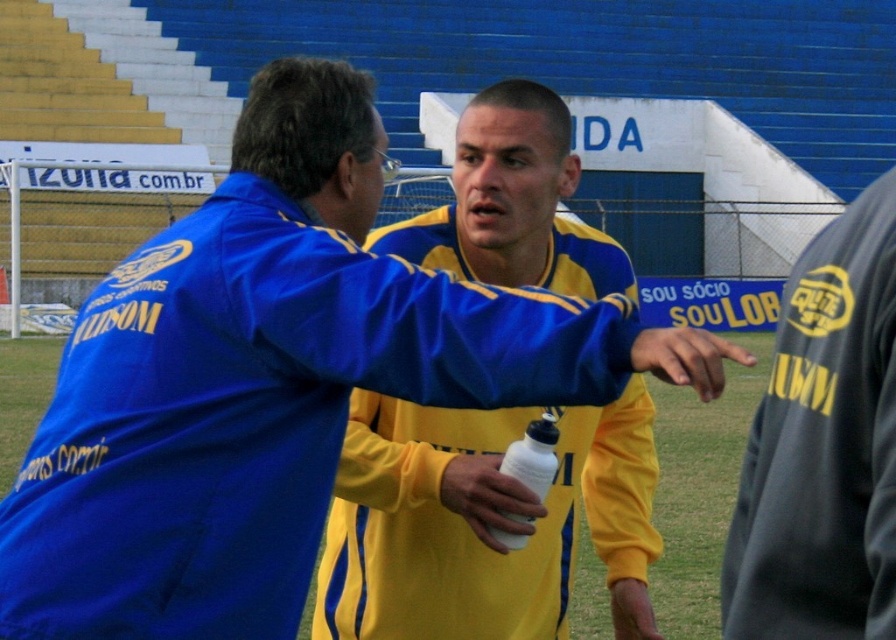
You are a photographer positioned at the edge of the soccer field. You need to capture a photo where both the white matte water bottle at center and the white matte bottle at center are clearly visible. Which one should you focus on to ensure the taller object is in sharp focus?

The white matte bottle at center is taller than the white matte water bottle at center. Therefore, to ensure the taller object is in sharp focus, you should focus on the white matte bottle at center.

You are a photographer positioned at the edge of the soccer field. You need to capture a closeup of the white matte water bottle at center and the white matte bottle at center. Which one should you zoom in on to ensure it appears wider in the photo?

The white matte water bottle at center should be zoomed in on because its width surpasses that of the white matte bottle at center, making it the wider option between the two.